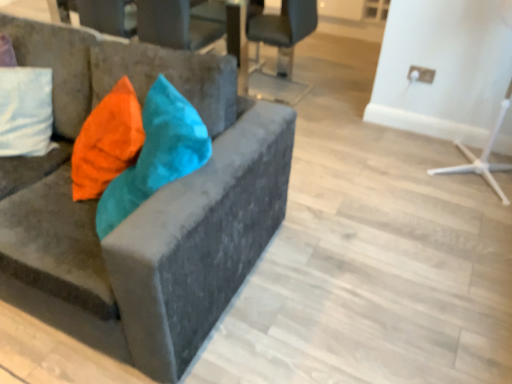
Question: From a real-world perspective, is velvet orange pillow at left physically above matte black chair at upper center, which is the third chair from front to back?

Choices:
 (A) no
 (B) yes

Answer: (B)

Question: Considering the relative sizes of velvet orange pillow at left and matte black chair at upper center, which is the third chair from front to back, in the image provided, is velvet orange pillow at left bigger than matte black chair at upper center, which is the third chair from front to back,?

Choices:
 (A) no
 (B) yes

Answer: (A)

Question: Considering the relative sizes of velvet orange pillow at left and matte black chair at upper center, which is the third chair from front to back, in the image provided, is velvet orange pillow at left wider than matte black chair at upper center, which is the third chair from front to back,?

Choices:
 (A) no
 (B) yes

Answer: (A)

Question: Does velvet orange pillow at left lie behind matte black chair at upper center, which is the third chair from front to back?

Choices:
 (A) yes
 (B) no

Answer: (B)

Question: Is velvet orange pillow at left shorter than matte black chair at upper center, which is the third chair from front to back?

Choices:
 (A) no
 (B) yes

Answer: (B)

Question: Choose the correct answer: Is matte black chair at upper center, which ranks as the first chair in back-to-front order, inside metallic gray chair at upper center, which is counted as the 2th chair, starting from the back, or outside it?

Choices:
 (A) outside
 (B) inside

Answer: (A)

Question: Based on their sizes in the image, would you say matte black chair at upper center, which ranks as the first chair in back-to-front order, is bigger or smaller than metallic gray chair at upper center, which is counted as the 2th chair, starting from the back?

Choices:
 (A) small
 (B) big

Answer: (B)

Question: From the image's perspective, is matte black chair at upper center, which is the third chair from front to back, located above or below metallic gray chair at upper center, arranged as the second chair when viewed from the front?

Choices:
 (A) above
 (B) below

Answer: (B)

Question: Does point (256, 21) appear closer or farther from the camera than point (159, 3)?

Choices:
 (A) closer
 (B) farther

Answer: (B)

Question: Based on their positions, is matte black chair at upper center, which is the third chair from front to back, located to the left or right of velvet orange pillow at left?

Choices:
 (A) right
 (B) left

Answer: (A)

Question: From a real-world perspective, is matte black chair at upper center, which is the third chair from front to back, positioned above or below velvet orange pillow at left?

Choices:
 (A) below
 (B) above

Answer: (A)

Question: In terms of height, does matte black chair at upper center, which ranks as the first chair in back-to-front order, look taller or shorter compared to velvet orange pillow at left?

Choices:
 (A) short
 (B) tall

Answer: (B)

Question: Considering the positions of matte black chair at upper center, which ranks as the first chair in back-to-front order, and velvet orange pillow at left in the image, is matte black chair at upper center, which ranks as the first chair in back-to-front order, wider or thinner than velvet orange pillow at left?

Choices:
 (A) wide
 (B) thin

Answer: (A)

Question: Would you say metallic gray chair at upper center, arranged as the second chair when viewed from the front, is to the left or to the right of velvet orange pillow at left in the picture?

Choices:
 (A) right
 (B) left

Answer: (A)

Question: Relative to velvet orange pillow at left, is metallic gray chair at upper center, which is counted as the 2th chair, starting from the back, in front or behind?

Choices:
 (A) behind
 (B) front

Answer: (A)